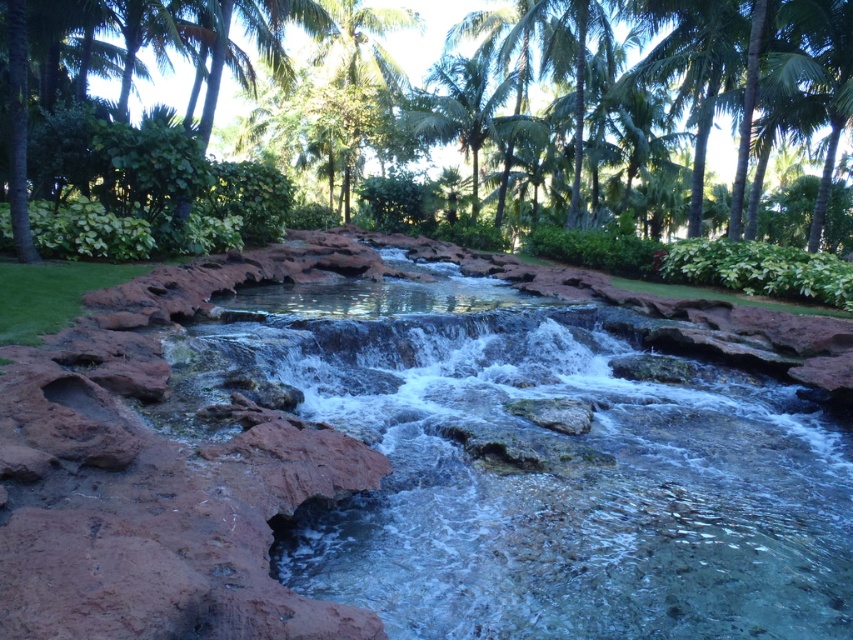
You are standing at the edge of the water feature described in the scene. There is a specific point marked at coordinates point (x=532, y=465). What can you observe about the water at that exact location?

The water at point (x=532, y=465) is clear and glistens under sunlight, reflecting the surrounding environment.

You are standing in the outdoor scene and want to take a photo of both the clear water at center and the green leafy palm tree at upper center. Which object should you position to the right side of your camera frame to include both in the shot?

You should position the green leafy palm tree at upper center to the right side of your camera frame because the clear water at center is to the left of it, allowing both to be captured in the shot.